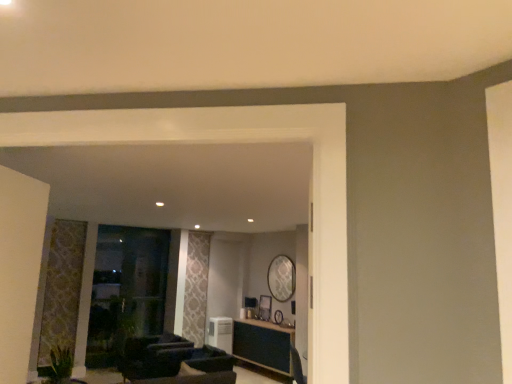
Question: Can you confirm if wooden table at center is bigger than wooden picture frame at center?

Choices:
 (A) yes
 (B) no

Answer: (A)

Question: Is wooden table at center oriented away from wooden picture frame at center?

Choices:
 (A) no
 (B) yes

Answer: (A)

Question: Is wooden table at center oriented towards wooden picture frame at center?

Choices:
 (A) yes
 (B) no

Answer: (B)

Question: Can you see wooden table at center touching wooden picture frame at center?

Choices:
 (A) no
 (B) yes

Answer: (A)

Question: From the image's perspective, does wooden table at center appear lower than wooden picture frame at center?

Choices:
 (A) yes
 (B) no

Answer: (A)

Question: Is wooden table at center to the right of wooden picture frame at center from the viewer's perspective?

Choices:
 (A) yes
 (B) no

Answer: (A)

Question: From a real-world perspective, is green leafy plant at lower left below white plastic air conditioner at center?

Choices:
 (A) yes
 (B) no

Answer: (B)

Question: Considering the relative sizes of green leafy plant at lower left and white plastic air conditioner at center in the image provided, is green leafy plant at lower left wider than white plastic air conditioner at center?

Choices:
 (A) no
 (B) yes

Answer: (B)

Question: Could white plastic air conditioner at center be considered to be inside green leafy plant at lower left?

Choices:
 (A) yes
 (B) no

Answer: (B)

Question: Is green leafy plant at lower left smaller than white plastic air conditioner at center?

Choices:
 (A) no
 (B) yes

Answer: (B)

Question: From the image's perspective, is green leafy plant at lower left on top of white plastic air conditioner at center?

Choices:
 (A) no
 (B) yes

Answer: (B)

Question: Is green leafy plant at lower left at the left side of white plastic air conditioner at center?

Choices:
 (A) no
 (B) yes

Answer: (B)

Question: From the image's perspective, is wooden picture frame at center below green leafy plant at lower left?

Choices:
 (A) yes
 (B) no

Answer: (A)